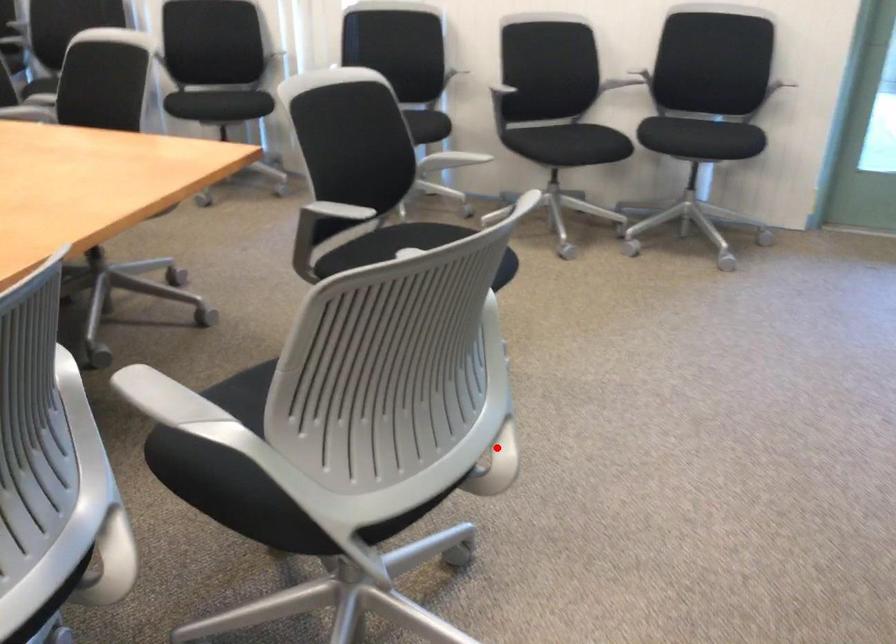
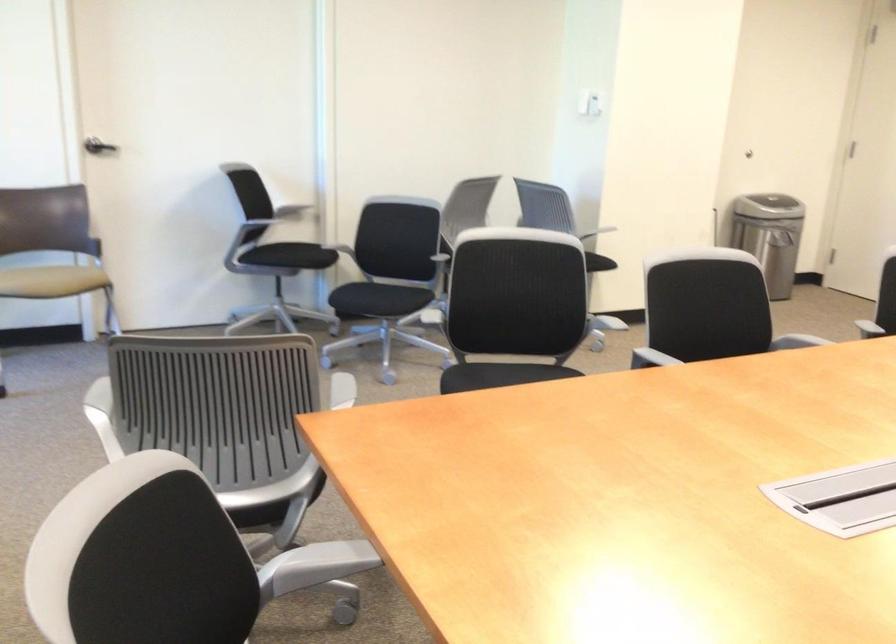
Question: I am providing you with two images of the same scene from different viewpoints. A red point is marked on the first image. Can you still see the location of the red point in image 2?

Choices:
 (A) Yes
 (B) No

Answer: (B)